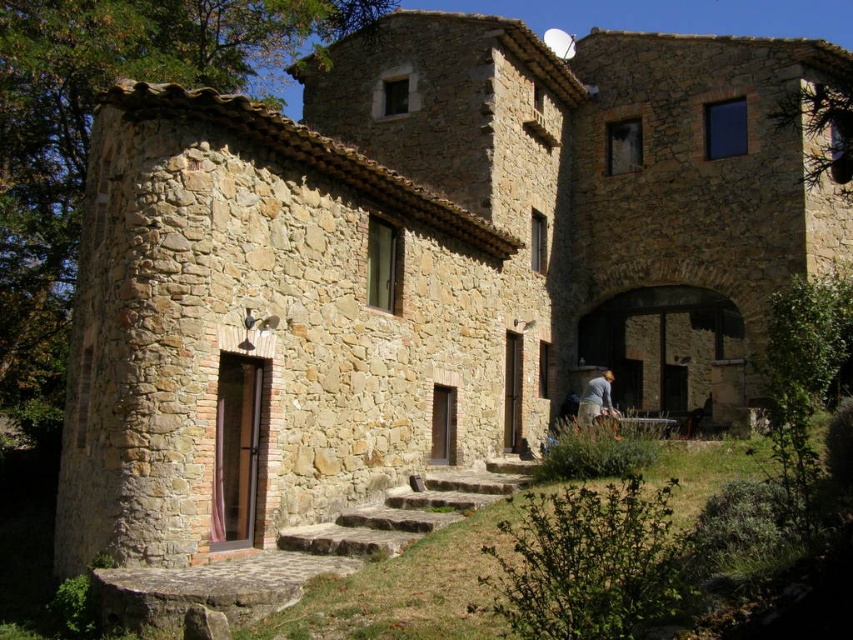
You are standing at the entrance of the rustic stone building and want to greet someone wearing the gray fabric shirt at lower right. Which direction should you move relative to the natural stone stairs at center to reach the person?

You should move away from the natural stone stairs at center towards the gray fabric shirt at lower right since the stairs are in front of the shirt, meaning the shirt is behind the stairs from your perspective.

You are standing at the base of the natural stone stairs at center and want to reach the gray fabric shirt at lower right. Which direction should you move to get closer to the shirt?

To reach the gray fabric shirt at lower right from the natural stone stairs at center, you should move downward since the stairs are located below the shirt.

You are a delivery person carrying a package and need to approach the entrance of the rustic stone building. You see the natural stone stairs at lower center and the gray fabric shirt at lower right. Which object is bigger in size?

The natural stone stairs at lower center is larger in size than the gray fabric shirt at lower right.